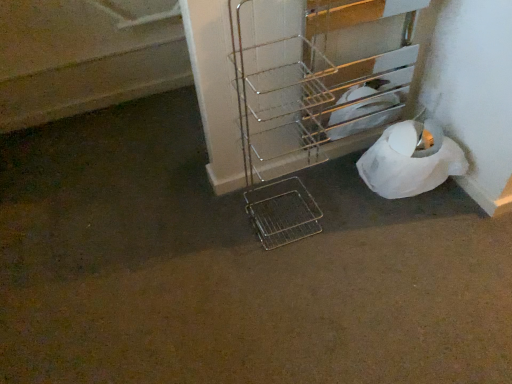
Question: Considering the positions of metallic wire trolley at lower right, acting as the first trolley starting from the right, and white paper at lower right in the image, is metallic wire trolley at lower right, acting as the first trolley starting from the right, taller or shorter than white paper at lower right?

Choices:
 (A) tall
 (B) short

Answer: (A)

Question: Is point (317, 62) positioned closer to the camera than point (376, 142)?

Choices:
 (A) closer
 (B) farther

Answer: (A)

Question: Considering the real-world distances, which object is closest to the metallic wire trolley at lower right, acting as the first trolley starting from the right?

Choices:
 (A) metallic wire trolley at center, the first trolley in the left-to-right sequence
 (B) white paper at lower right

Answer: (A)

Question: Considering the real-world distances, which object is farthest from the metallic wire trolley at center, marked as the second trolley in a right-to-left arrangement?

Choices:
 (A) white paper at lower right
 (B) metallic wire trolley at lower right, acting as the first trolley starting from the right

Answer: (A)